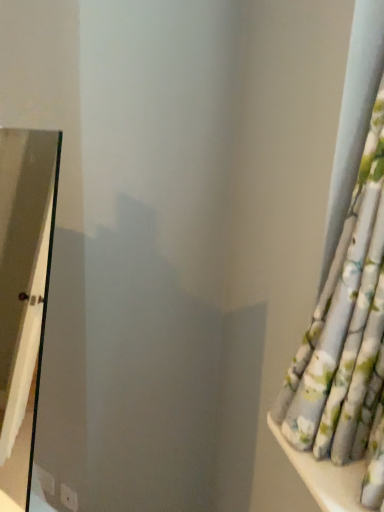
I want to click on clear glass screen door at left, so click(x=24, y=281).

Describe the element at coordinates (24, 281) in the screenshot. The width and height of the screenshot is (384, 512). I see `clear glass screen door at left` at that location.

At what (x,y) coordinates should I click in order to perform the action: click on clear glass screen door at left. Please return your answer as a coordinate pair (x, y). Looking at the image, I should click on (24, 281).